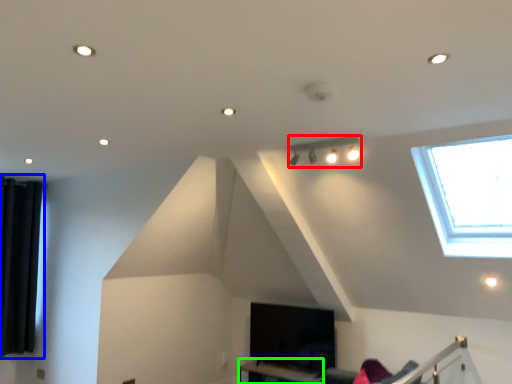
Question: Which is farther away from lamp (highlighted by a red box)? curtain (highlighted by a blue box) or table (highlighted by a green box)?

Choices:
 (A) curtain
 (B) table

Answer: (A)